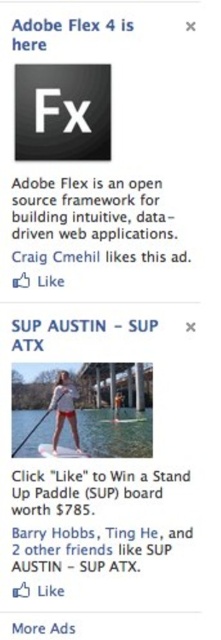
You are a waterskiing instructor observing a student preparing to water ski. The student has a white glossy water ski at lower center and a white fabric paddle at center. Which object is shorter?

The white glossy water ski at lower center is shorter than the white fabric paddle at center.

In the scene shown: You are a user looking at the image of a Facebook feed with two ads. You see the white glossy water ski at lower center and the white fabric paddle at center. Which object is placed above the other?

The white glossy water ski at lower center is positioned over the white fabric paddle at center, so it is placed above the paddle.

You are a photographer standing 200 feet away from a model wearing white fabric shorts at center. If you want to take a photo where the shorts appear larger in the frame, should you move closer or farther away?

The white fabric shorts at center are currently 168.98 feet away from the camera. To make them appear larger in the photo, you should move closer to the model, reducing the distance between the camera and the shorts.